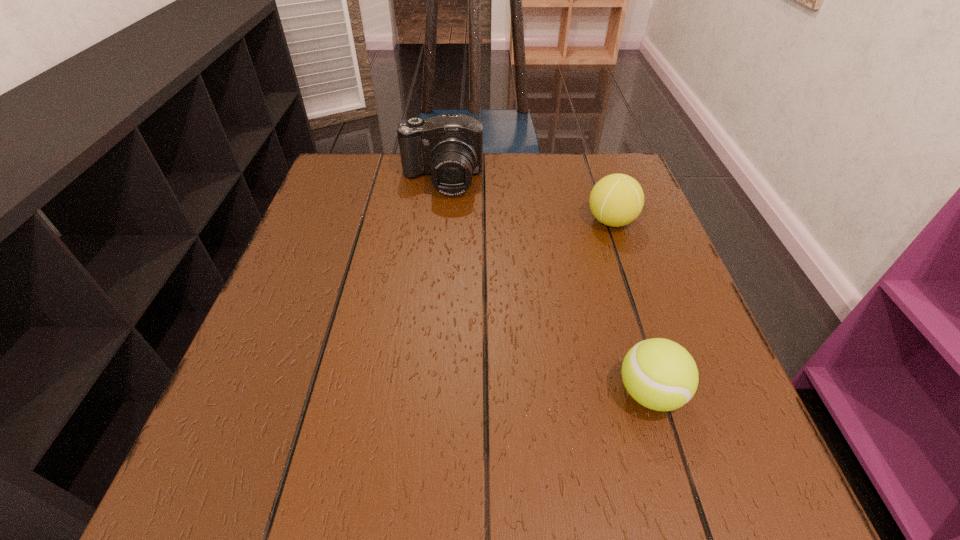
At what (x,y) coordinates should I click in order to perform the action: click on free spot that satisfies the following two spatial constraints: 1. on the back side of the second farthest object; 2. on the left side of the nearest object. Please return your answer as a coordinate pair (x, y). The height and width of the screenshot is (540, 960). Looking at the image, I should click on (597, 221).